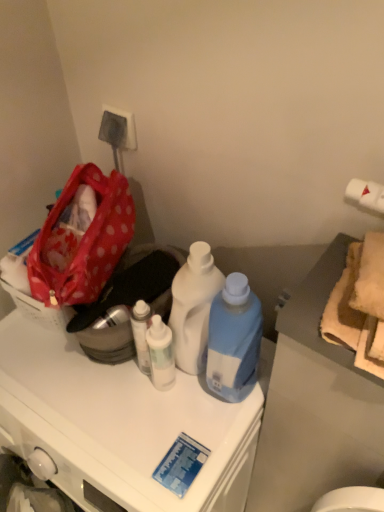
Identify the location of vacant space to the right of white glossy bottle at center, acting as the 3th bottle starting from the right. (217, 401).